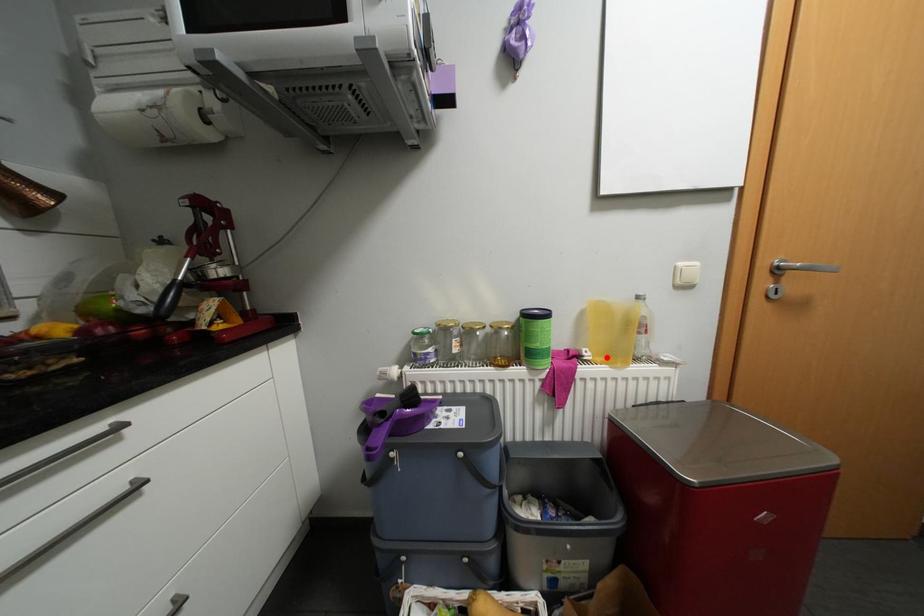
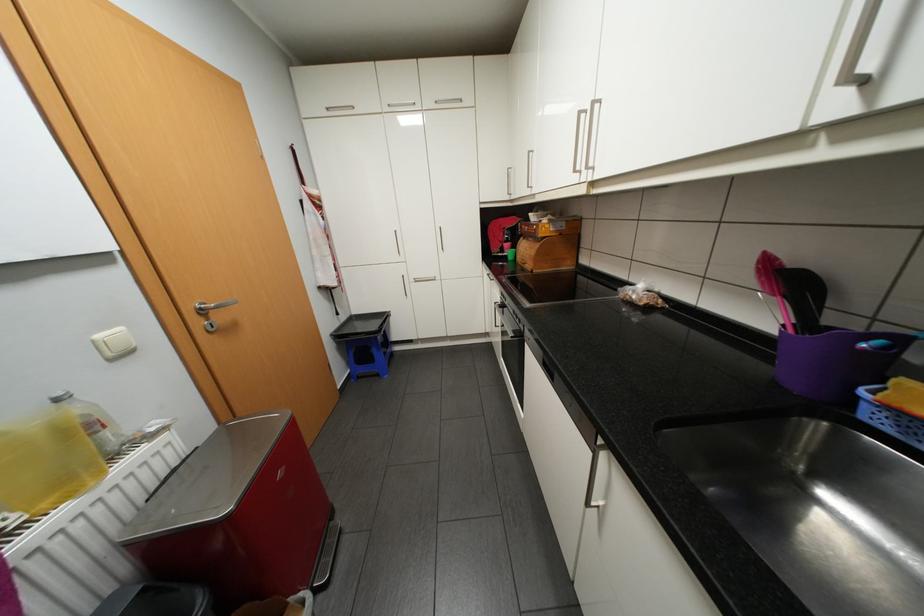
The point at the highlighted location is marked in the first image. Where is the corresponding point in the second image?

(53, 504)